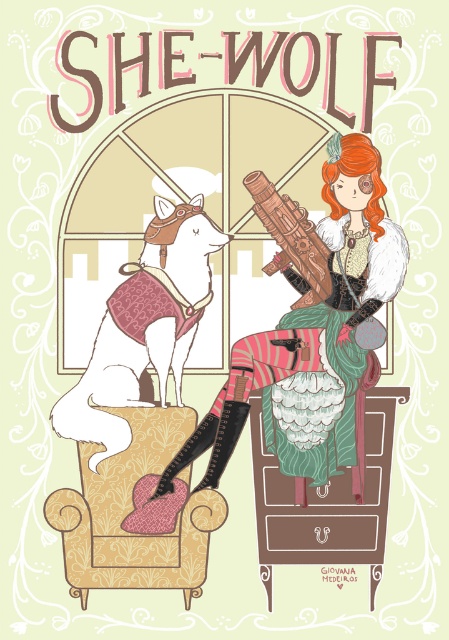
Who is lower down, patterned fabric armchair at center or green fabric armchair at center?

Positioned lower is patterned fabric armchair at center.

The image size is (449, 640). In order to click on patterned fabric armchair at center in this screenshot , I will do `click(133, 513)`.

The image size is (449, 640). What do you see at coordinates (133, 513) in the screenshot?
I see `patterned fabric armchair at center` at bounding box center [133, 513].

Where is `patterned fabric armchair at center`? The image size is (449, 640). patterned fabric armchair at center is located at coordinates (133, 513).

Which is behind, point (180, 403) or point (273, 541)?

Positioned behind is point (273, 541).

Between velvet-patterned armchair at left and green fabric armchair at center, which one appears on the right side from the viewer's perspective?

From the viewer's perspective, green fabric armchair at center appears more on the right side.

The image size is (449, 640). Describe the element at coordinates (145, 324) in the screenshot. I see `velvet-patterned armchair at left` at that location.

Identify the location of velvet-patterned armchair at left. Image resolution: width=449 pixels, height=640 pixels. (145, 324).

Is the position of velvet-patterned armchair at left less distant than that of wooden carved gun at center?

No, it is not.

Who is more forward, (118, 396) or (324, 275)?

Point (118, 396) is in front.

The width and height of the screenshot is (449, 640). In order to click on velvet-patterned armchair at left in this screenshot , I will do `click(145, 324)`.